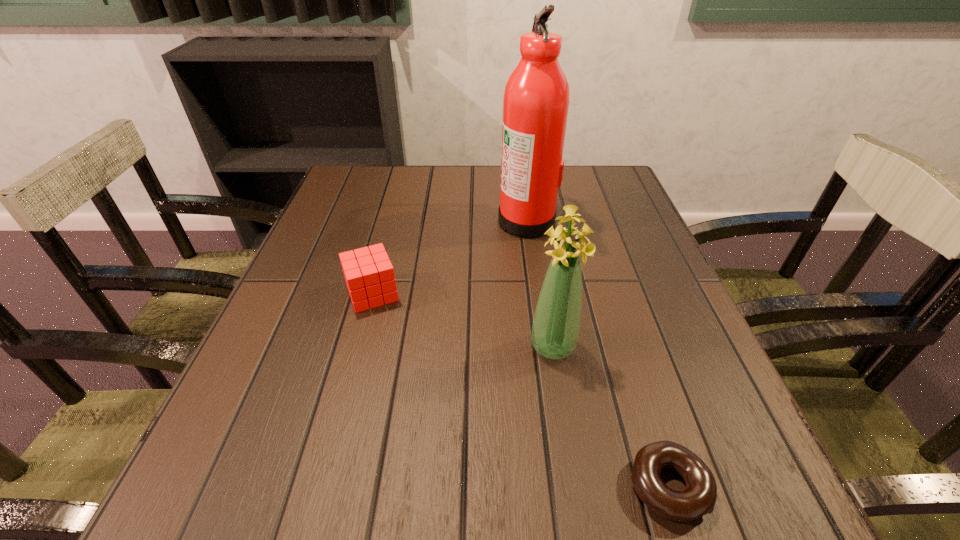
This screenshot has height=540, width=960. Find the location of `fire extinguisher`. fire extinguisher is located at coordinates (536, 100).

Where is `the tallest object`? the tallest object is located at coordinates (536, 100).

Find the location of a particular element. the second tallest object is located at coordinates (556, 324).

I want to click on the third farthest object, so click(x=556, y=324).

Locate an element on the screen. The image size is (960, 540). the leftmost object is located at coordinates (369, 275).

In order to click on cube in this screenshot , I will do `click(369, 275)`.

Where is `the shortest object`? the shortest object is located at coordinates (699, 497).

Find the location of `the rightmost object`. the rightmost object is located at coordinates (699, 497).

The width and height of the screenshot is (960, 540). Find the location of `free space located 0.390m on the label side of the fire extinguisher`. free space located 0.390m on the label side of the fire extinguisher is located at coordinates (339, 220).

What are the coordinates of `vacant area situated 0.130m on the label side of the fire extinguisher` in the screenshot? It's located at (445, 220).